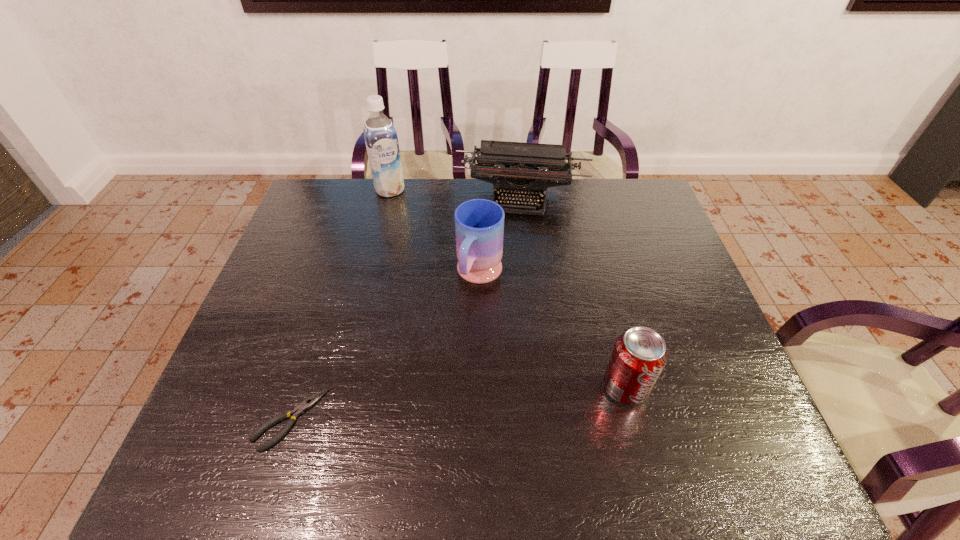
The width and height of the screenshot is (960, 540). Identify the location of free spot on the desktop that is between the shortest object and the soda can and is positioned on the label of the tallest object. 484,401.

Where is `vacant spot on the desktop that is between the shortest object and the soda can and is positioned on the side of the mug with the handle`? The height and width of the screenshot is (540, 960). vacant spot on the desktop that is between the shortest object and the soda can and is positioned on the side of the mug with the handle is located at coordinates (414, 407).

Identify the location of free space on the desktop that is between the shortest object and the soda can and is positioned on the typing side of the typewriter. (495, 400).